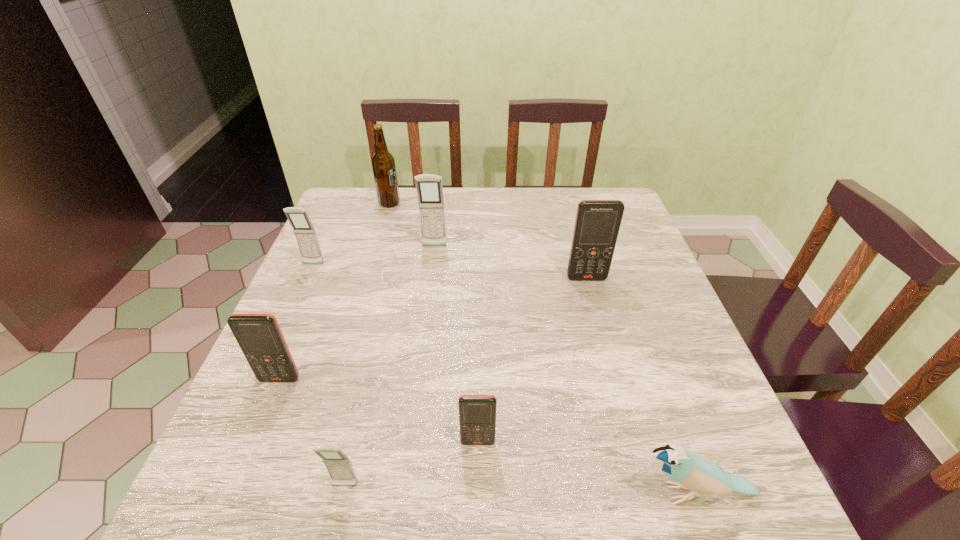
Image resolution: width=960 pixels, height=540 pixels. Find the location of `free space between the fifth farthest cellular telephone and the second nearest orange cellular telephone`. free space between the fifth farthest cellular telephone and the second nearest orange cellular telephone is located at coordinates (379, 410).

The image size is (960, 540). I want to click on vacant area that lies between the smallest gray cellular telephone and the second biggest orange cellular telephone, so click(312, 433).

Where is `free space between the fourth cellular telephone from left to right and the third nearest object`? free space between the fourth cellular telephone from left to right and the third nearest object is located at coordinates (456, 345).

At what (x,y) coordinates should I click in order to perform the action: click on vacant space that is in between the beer bottle and the second orange cellular telephone from left to right. Please return your answer as a coordinate pair (x, y). Looking at the image, I should click on (434, 322).

Find the location of a particular element. unoccupied position between the sixth object from right to left and the rightmost cellular telephone is located at coordinates (488, 241).

Where is `free spot between the fourth cellular telephone from left to right and the fourth nearest object`? free spot between the fourth cellular telephone from left to right and the fourth nearest object is located at coordinates click(357, 313).

Locate an element on the screen. The height and width of the screenshot is (540, 960). vacant area that lies between the nearest cellular telephone and the second smallest orange cellular telephone is located at coordinates (312, 433).

Where is `the closest object to the nearest orange cellular telephone`? The height and width of the screenshot is (540, 960). the closest object to the nearest orange cellular telephone is located at coordinates (338, 465).

The width and height of the screenshot is (960, 540). I want to click on object that is the sixth closest to the sixth object from right to left, so click(338, 465).

The image size is (960, 540). I want to click on cellular telephone that is the closest to the farthest orange cellular telephone, so click(429, 188).